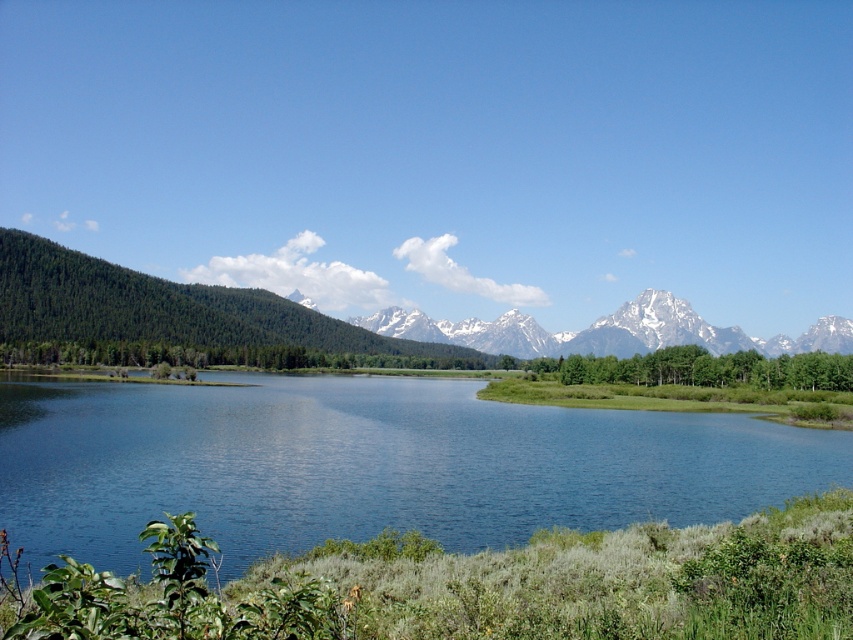
You are standing at the point with coordinates [369,465] in the image. What do you see immediately around you?

You see blue glassy water at center around you.

You are standing at a viewpoint overlooking the lake and mountains. There are two points marked on the landscape. The first point is at coordinates point (142,452) and the second is at point (521,333). Which point is closer to your current position?

Point (142,452) is closer to the camera than point (521,333), so the first point is closer to your current position.

You are standing at the edge of the lake and want to take a photo that includes both the blue glassy water at center and the green forested mountain range at upper left. Which object will appear closer to the bottom of your photo?

The blue glassy water at center will appear closer to the bottom of your photo because it is shorter than the green forested mountain range at upper left.